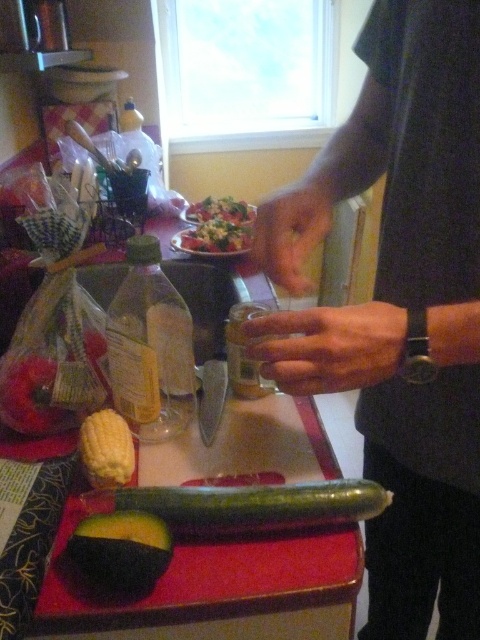
Is green matte avocado at lower left bigger than yellow matte corn at lower left?

Incorrect, green matte avocado at lower left is not larger than yellow matte corn at lower left.

Does green matte avocado at lower left appear over yellow matte corn at lower left?

No, green matte avocado at lower left is not above yellow matte corn at lower left.

The height and width of the screenshot is (640, 480). Find the location of `green matte avocado at lower left`. green matte avocado at lower left is located at coordinates (120, 550).

Looking at this image, how much distance is there between yellow matte corn at lower left and shiny green salad at center?

yellow matte corn at lower left and shiny green salad at center are 26.60 inches apart.

Which is behind, point (124, 468) or point (241, 211)?

The point (241, 211) is more distant.

Where is `yellow matte corn at lower left`? This screenshot has height=640, width=480. yellow matte corn at lower left is located at coordinates (107, 449).

Does black fabric shirt at center have a lesser height compared to shiny green salad at center?

No, black fabric shirt at center is not shorter than shiny green salad at center.

Does black fabric shirt at center have a lesser width compared to shiny green salad at center?

In fact, black fabric shirt at center might be wider than shiny green salad at center.

Locate an element on the screen. This screenshot has width=480, height=640. black fabric shirt at center is located at coordinates (400, 307).